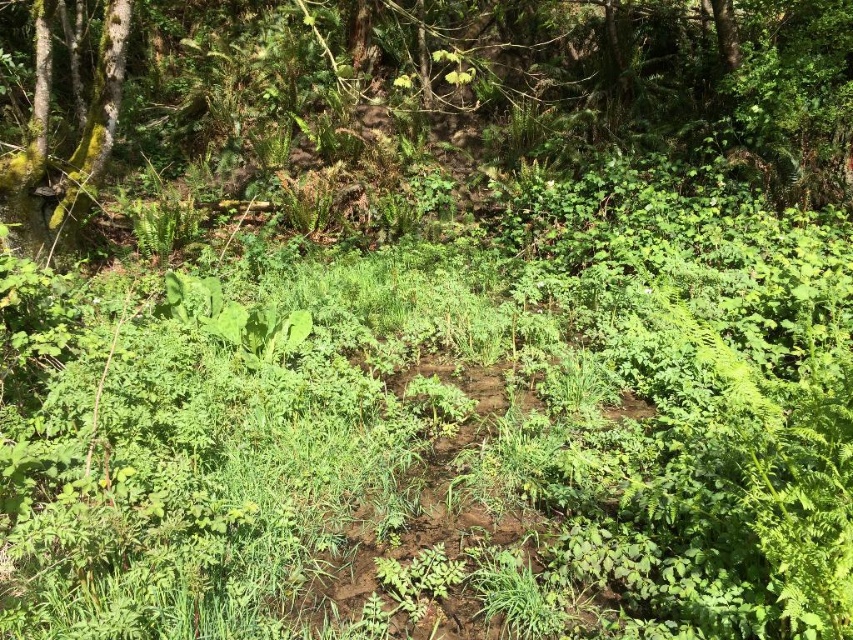
Question: Is the position of green leafy tree at upper center more distant than that of green mossy tree at upper left?

Choices:
 (A) no
 (B) yes

Answer: (A)

Question: Does green leafy tree at upper center have a lesser width compared to green mossy tree at upper left?

Choices:
 (A) yes
 (B) no

Answer: (B)

Question: Can you confirm if green leafy tree at upper center is positioned to the right of green mossy tree at upper left?

Choices:
 (A) no
 (B) yes

Answer: (B)

Question: Which of the following is the farthest from the observer?

Choices:
 (A) green mossy tree at upper left
 (B) green leafy tree at upper center

Answer: (A)